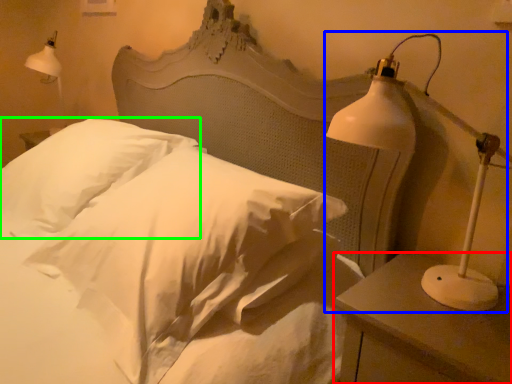
Question: Estimate the real-world distances between objects in this image. Which object is farther from nightstand (highlighted by a red box), lamp (highlighted by a blue box) or pillow (highlighted by a green box)?

Choices:
 (A) lamp
 (B) pillow

Answer: (B)